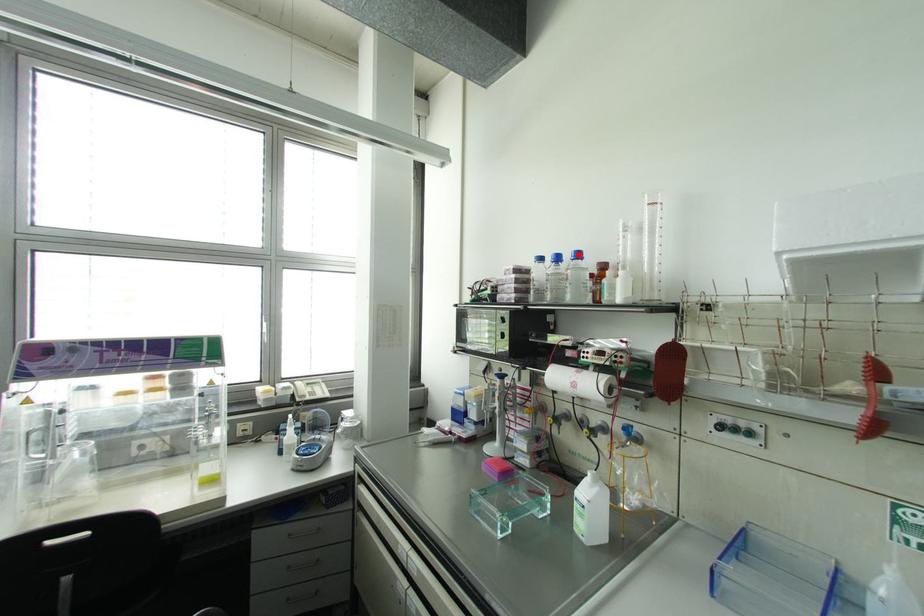
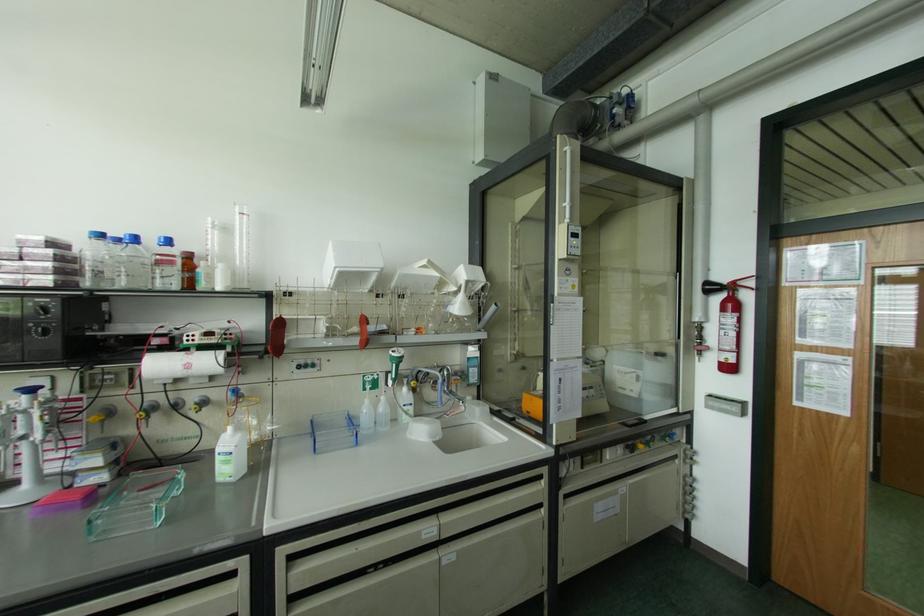
Find the pixel in the second image that matches the highlighted location in the first image.

(167, 241)